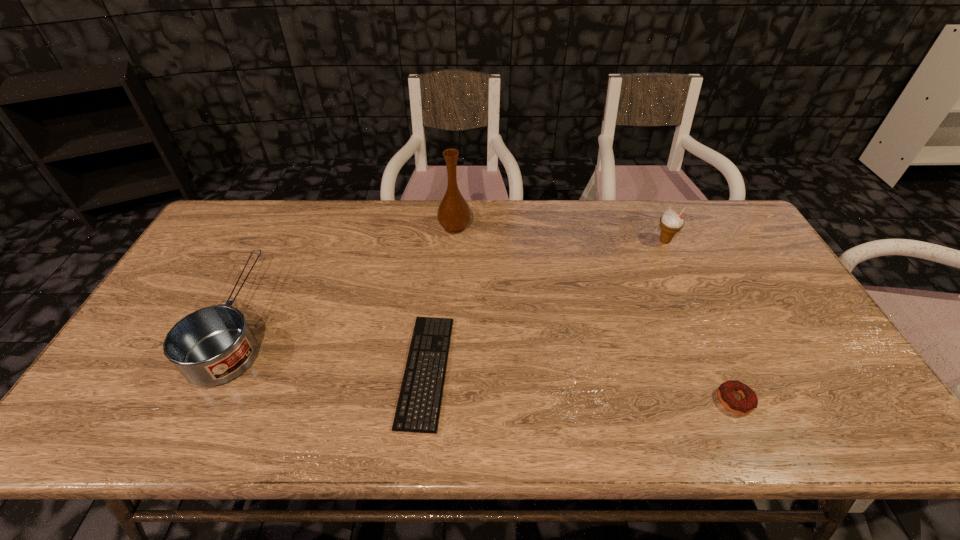
Locate an element on the screen. vacant point located between the leftmost object and the computer keyboard is located at coordinates (333, 346).

This screenshot has height=540, width=960. Identify the location of free spot between the vase and the leftmost object. (348, 274).

At what (x,y) coordinates should I click in order to perform the action: click on object that is the closest to the computer keyboard. Please return your answer as a coordinate pair (x, y). Looking at the image, I should click on (453, 214).

Where is `object that is the second closest to the doughnut`? The width and height of the screenshot is (960, 540). object that is the second closest to the doughnut is located at coordinates (418, 408).

Where is `blank area in the image that satisfies the following two spatial constraints: 1. with the handle extending from one side of the leftmost object; 2. on the left side of the fourth shortest object`? The height and width of the screenshot is (540, 960). blank area in the image that satisfies the following two spatial constraints: 1. with the handle extending from one side of the leftmost object; 2. on the left side of the fourth shortest object is located at coordinates (280, 241).

Where is `blank area in the image that satisfies the following two spatial constraints: 1. with the handle extending from one side of the leftmost object; 2. on the left side of the fourth shortest object`? The width and height of the screenshot is (960, 540). blank area in the image that satisfies the following two spatial constraints: 1. with the handle extending from one side of the leftmost object; 2. on the left side of the fourth shortest object is located at coordinates (280, 241).

Where is `free space that satisfies the following two spatial constraints: 1. with the handle extending from one side of the third shortest object; 2. on the left side of the second tallest object`? The height and width of the screenshot is (540, 960). free space that satisfies the following two spatial constraints: 1. with the handle extending from one side of the third shortest object; 2. on the left side of the second tallest object is located at coordinates (280, 241).

This screenshot has width=960, height=540. In order to click on free location that satisfies the following two spatial constraints: 1. with the handle extending from one side of the tallest object; 2. on the right side of the third tallest object in this screenshot , I will do `click(287, 227)`.

Locate an element on the screen. This screenshot has height=540, width=960. vacant position in the image that satisfies the following two spatial constraints: 1. with the handle extending from one side of the leftmost object; 2. on the right side of the icecream is located at coordinates (280, 241).